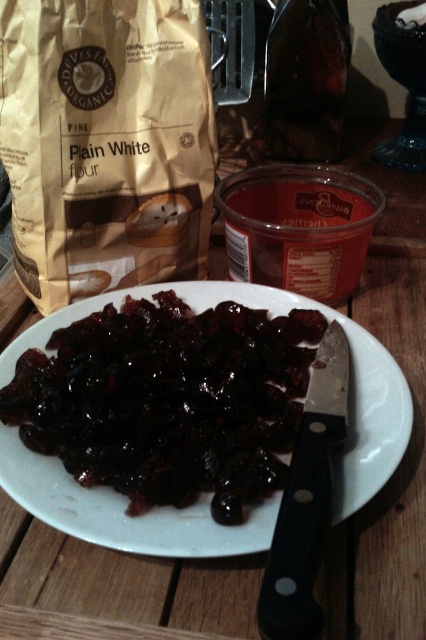
You are a chef preparing a recipe that requires both the brown paper bag at upper left and the shiny dark brown raisins at center. If you need to stack these items vertically to save counter space, which one should you place at the bottom to ensure stability?

The brown paper bag at upper left has a greater height compared to the shiny dark brown raisins at center. Therefore, placing the taller brown paper bag at upper left at the bottom will provide a stable base for the stack.

Looking at the kitchen counter, there is a brown paper bag at upper left and shiny dark brown raisins at center. Which item is positioned to the left of the other?

The brown paper bag at upper left is to the left of shiny dark brown raisins at center.